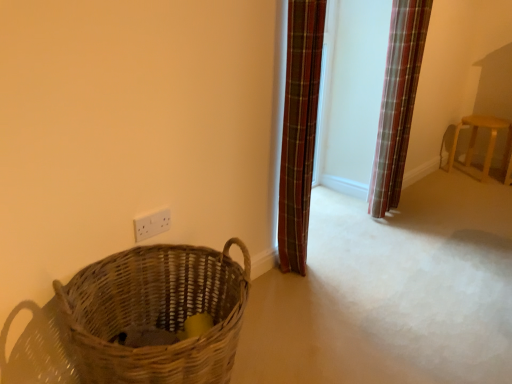
Question: Considering the positions of point (161, 215) and point (381, 162), is point (161, 215) closer or farther from the camera than point (381, 162)?

Choices:
 (A) closer
 (B) farther

Answer: (A)

Question: Considering the relative positions of white plastic electric outlet at lower left and plaid fabric curtain at right, which ranks as the second curtain in front-to-back order, in the image provided, is white plastic electric outlet at lower left to the left or to the right of plaid fabric curtain at right, which ranks as the second curtain in front-to-back order,?

Choices:
 (A) right
 (B) left

Answer: (B)

Question: Which object is the farthest from the plaid fabric curtain at right, which appears as the first curtain when viewed from the back?

Choices:
 (A) plaid fabric curtain at center, placed as the first curtain when sorted from left to right
 (B) white plastic electric outlet at lower left
 (C) wooden stool at right
 (D) woven brown basket at lower left

Answer: (D)

Question: Estimate the real-world distances between objects in this image. Which object is closer to the wooden stool at right?

Choices:
 (A) plaid fabric curtain at center, the 1th curtain positioned from the front
 (B) woven brown basket at lower left
 (C) white plastic electric outlet at lower left
 (D) plaid fabric curtain at right, the first curtain when ordered from right to left

Answer: (D)